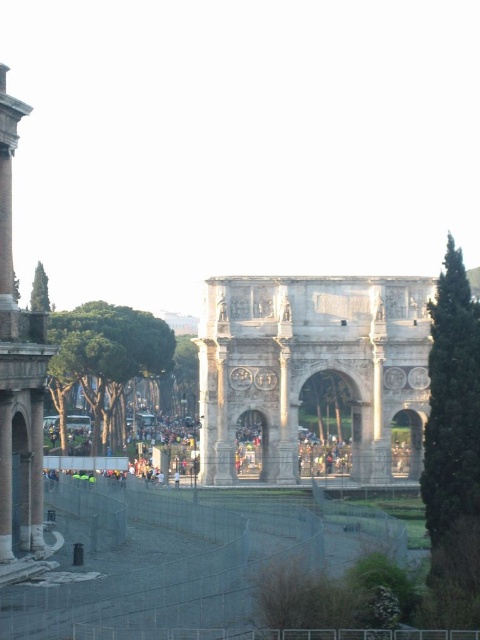
Question: Can you confirm if smooth stone column at left is bigger than white marble arch at center?

Choices:
 (A) yes
 (B) no

Answer: (B)

Question: Which point is farther to the camera?

Choices:
 (A) smooth stone column at left
 (B) white marble arch at center

Answer: (B)

Question: Which point appears closest to the camera in this image?

Choices:
 (A) (0, 266)
 (B) (312, 449)

Answer: (A)

Question: Is smooth stone column at left closer to the viewer compared to white marble arch at center?

Choices:
 (A) yes
 (B) no

Answer: (A)

Question: Considering the relative positions of smooth stone column at left and white marble arch at center in the image provided, where is smooth stone column at left located with respect to white marble arch at center?

Choices:
 (A) left
 (B) right

Answer: (A)

Question: Which object is closer to the camera taking this photo?

Choices:
 (A) white marble arch at center
 (B) smooth stone column at left

Answer: (B)